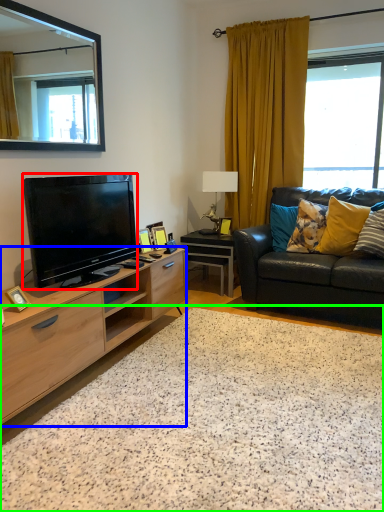
Question: Based on their relative distances, which object is farther from television (highlighted by a red box)? Choose from cabinetry (highlighted by a blue box) and granite (highlighted by a green box).

Choices:
 (A) cabinetry
 (B) granite

Answer: (B)